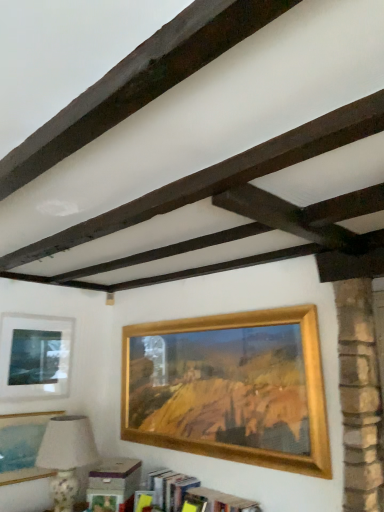
Question: Is matte glass picture frame at upper left, the 1th picture frame from the left, oriented towards porcelain floral table lamp at lower left?

Choices:
 (A) yes
 (B) no

Answer: (B)

Question: Considering the relative sizes of matte glass picture frame at upper left, the third picture frame when ordered from right to left, and porcelain floral table lamp at lower left in the image provided, is matte glass picture frame at upper left, the third picture frame when ordered from right to left, thinner than porcelain floral table lamp at lower left?

Choices:
 (A) no
 (B) yes

Answer: (B)

Question: Can you confirm if matte glass picture frame at upper left, the 1th picture frame from the left, is positioned to the left of porcelain floral table lamp at lower left?

Choices:
 (A) no
 (B) yes

Answer: (B)

Question: Is matte glass picture frame at upper left, the 1th picture frame from the left, smaller than porcelain floral table lamp at lower left?

Choices:
 (A) no
 (B) yes

Answer: (B)

Question: Is matte glass picture frame at upper left, the 1th picture frame from the left, completely or partially outside of porcelain floral table lamp at lower left?

Choices:
 (A) no
 (B) yes

Answer: (B)

Question: Is dark brown wood at upper center taller or shorter than porcelain floral table lamp at lower left?

Choices:
 (A) short
 (B) tall

Answer: (A)

Question: Relative to porcelain floral table lamp at lower left, is dark brown wood at upper center in front or behind?

Choices:
 (A) behind
 (B) front

Answer: (B)

Question: Which is correct: dark brown wood at upper center is inside porcelain floral table lamp at lower left, or outside of it?

Choices:
 (A) inside
 (B) outside

Answer: (B)

Question: Looking at their shapes, would you say dark brown wood at upper center is wider or thinner than porcelain floral table lamp at lower left?

Choices:
 (A) thin
 (B) wide

Answer: (A)

Question: Considering the positions of matte gold picture frame at lower left, arranged as the 2th picture frame when viewed from the right, and dark brown wood at upper center in the image, is matte gold picture frame at lower left, arranged as the 2th picture frame when viewed from the right, wider or thinner than dark brown wood at upper center?

Choices:
 (A) wide
 (B) thin

Answer: (B)

Question: Visually, is matte gold picture frame at lower left, which is the second picture frame from left to right, positioned to the left or to the right of dark brown wood at upper center?

Choices:
 (A) right
 (B) left

Answer: (B)

Question: Relative to dark brown wood at upper center, is matte gold picture frame at lower left, which is the second picture frame from left to right, in front or behind?

Choices:
 (A) behind
 (B) front

Answer: (A)

Question: Considering the positions of point (34, 478) and point (4, 190), is point (34, 478) closer or farther from the camera than point (4, 190)?

Choices:
 (A) farther
 (B) closer

Answer: (A)

Question: Considering the positions of matte glass picture frame at upper left, the 1th picture frame from the left, and dark brown wood at upper center in the image, is matte glass picture frame at upper left, the 1th picture frame from the left, taller or shorter than dark brown wood at upper center?

Choices:
 (A) tall
 (B) short

Answer: (A)

Question: Considering the positions of matte glass picture frame at upper left, the 1th picture frame from the left, and dark brown wood at upper center in the image, is matte glass picture frame at upper left, the 1th picture frame from the left, wider or thinner than dark brown wood at upper center?

Choices:
 (A) wide
 (B) thin

Answer: (B)